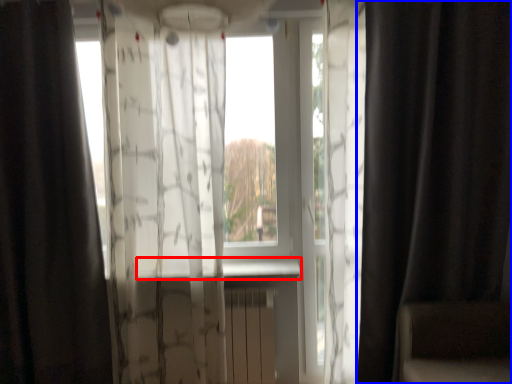
Question: Which object is closer to the camera taking this photo, window sill (highlighted by a red box) or curtain (highlighted by a blue box)?

Choices:
 (A) window sill
 (B) curtain

Answer: (B)